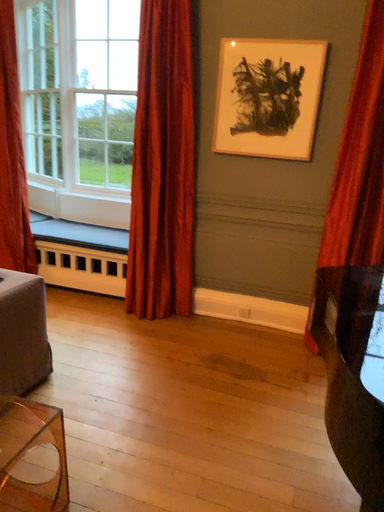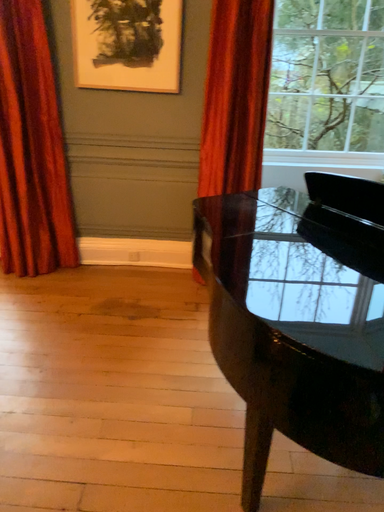
Question: Which way did the camera rotate in the video?

Choices:
 (A) rotated upward
 (B) rotated downward

Answer: (B)